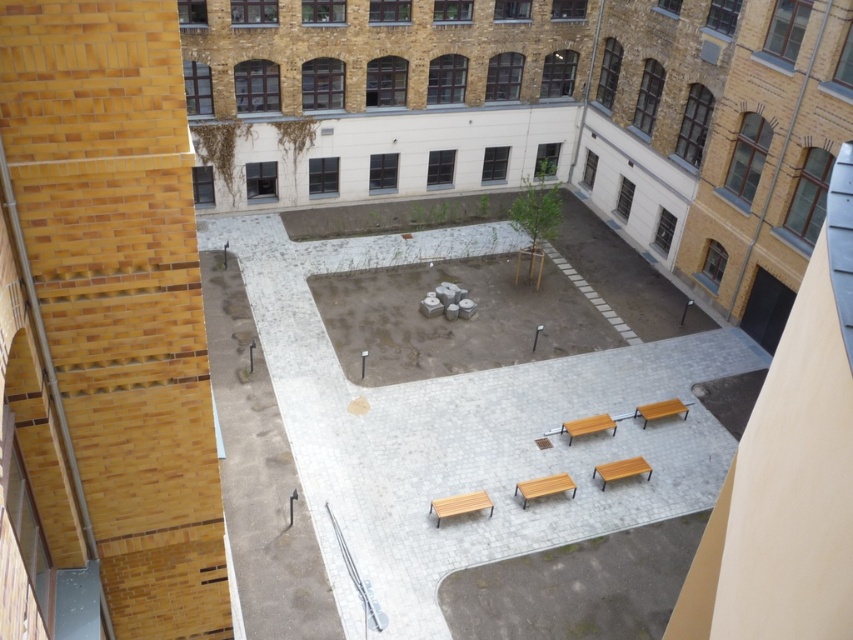
Question: Which of the following is the closest to the observer?

Choices:
 (A) orange matte park bench at lower right
 (B) brown wooden bench at center
 (C) wooden bench at center
 (D) smooth concrete bench at center

Answer: (D)

Question: Which point is closer to the camera?

Choices:
 (A) (x=608, y=465)
 (B) (x=349, y=248)
 (C) (x=567, y=442)
 (D) (x=447, y=515)

Answer: (D)

Question: Does smooth concrete bench at center have a greater width compared to orange matte park bench at lower right?

Choices:
 (A) yes
 (B) no

Answer: (A)

Question: Does wooden bench at center have a lesser width compared to orange matte park bench at lower right?

Choices:
 (A) yes
 (B) no

Answer: (A)

Question: Which object is positioned closest to the orange matte park bench at lower right?

Choices:
 (A) light brown wooden bench at center
 (B) smooth concrete bench at center

Answer: (A)

Question: Where is smooth concrete bench at center located in relation to light brown wooden bench at center in the image?

Choices:
 (A) above
 (B) below

Answer: (A)